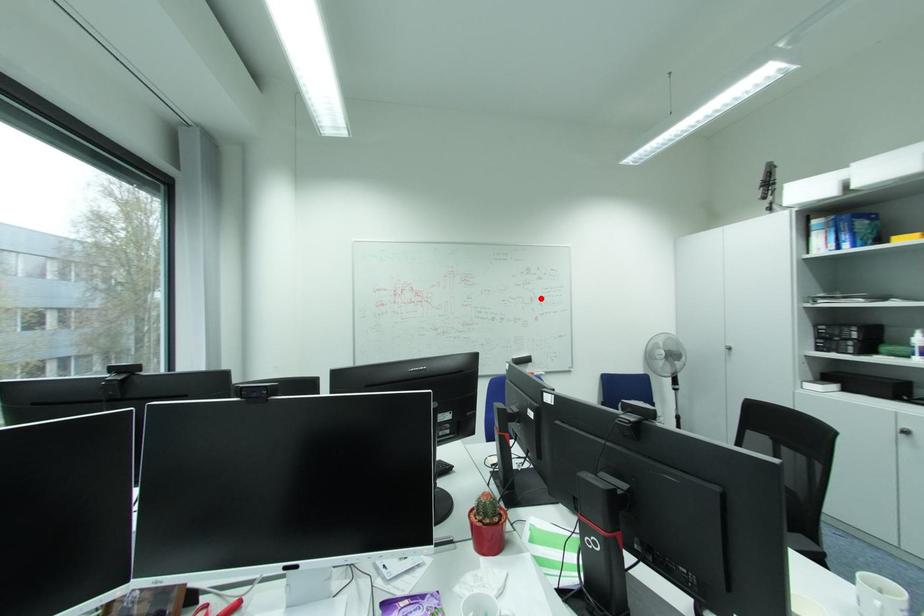
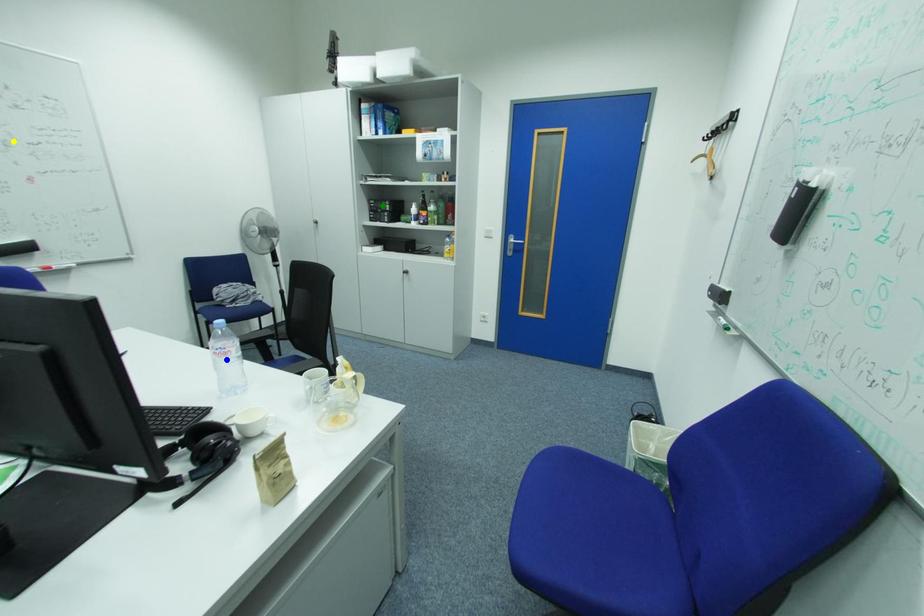
Question: I am providing you with two images of the same scene from different viewpoints. A red point is marked on the first image. You are given multiple points on the second image. Can you choose the point in image 2 that corresponds to the point in image 1?

Choices:
 (A) yellow point
 (B) green point
 (C) blue point

Answer: (A)